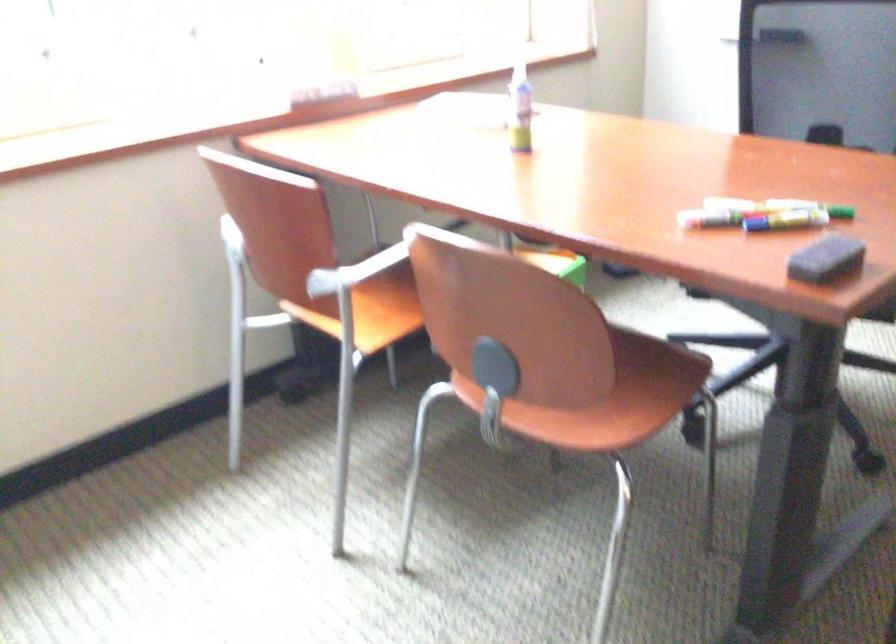
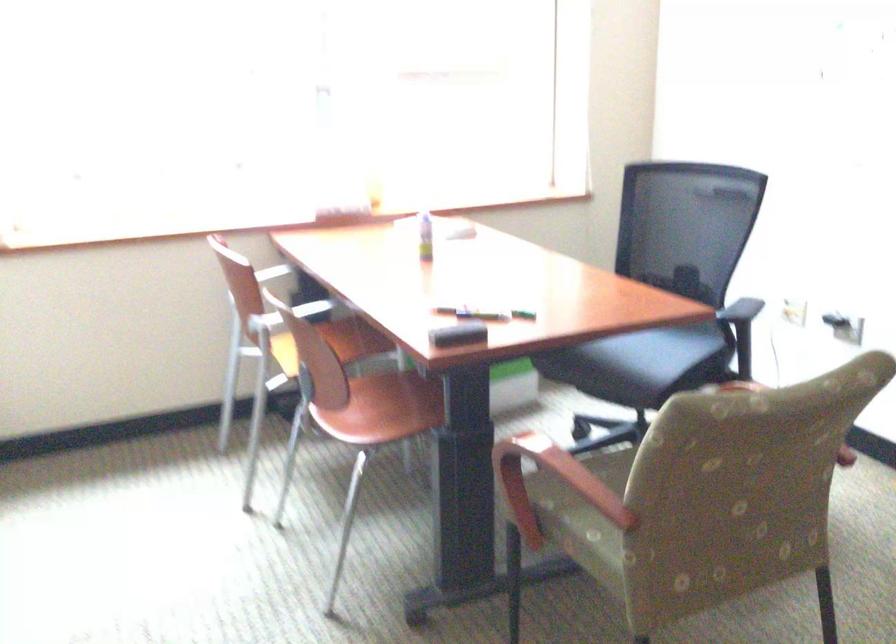
Where in the second image is the point corresponding to [519,122] from the first image?

(425, 236)